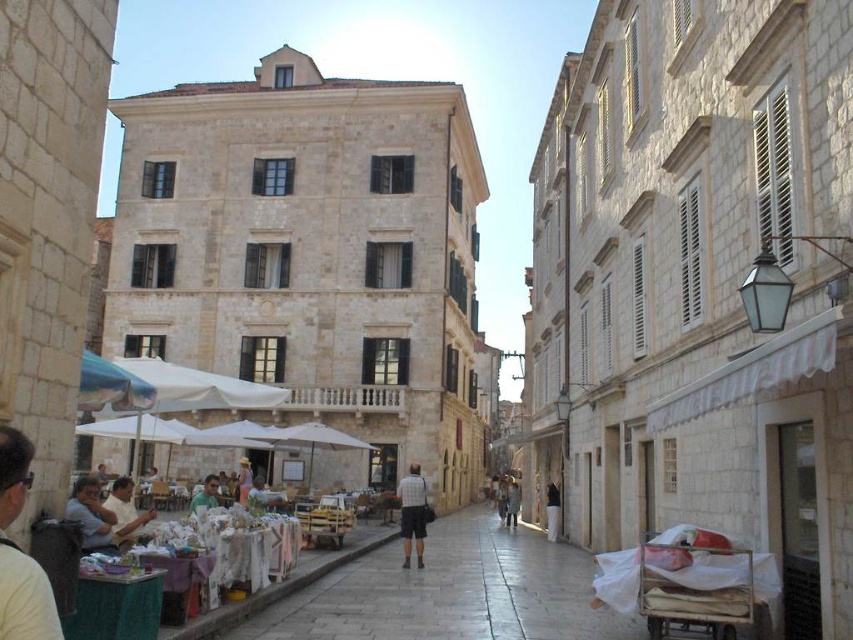
Question: Among these objects, which one is farthest from the camera?

Choices:
 (A) light gray cotton shirt at center
 (B) white fabric umbrella at center
 (C) light brown wooden chair at center
 (D) white cotton shirt at center

Answer: (B)

Question: Which point appears farthest from the camera in this image?

Choices:
 (A) (268, 499)
 (B) (209, 477)

Answer: (A)

Question: Does white fabric umbrella at center appear under light blue fabric at center?

Choices:
 (A) no
 (B) yes

Answer: (A)

Question: Is matte white shirt at lower left above white fabric umbrella at center?

Choices:
 (A) yes
 (B) no

Answer: (B)

Question: Which object appears farthest from the camera in this image?

Choices:
 (A) smooth stone pavement at center
 (B) light gray cotton shirt at center
 (C) light blue shirt at center
 (D) light blue fabric at center

Answer: (D)

Question: Can you confirm if matte white shirt at lower left is thinner than light brown wooden chair at center?

Choices:
 (A) no
 (B) yes

Answer: (A)